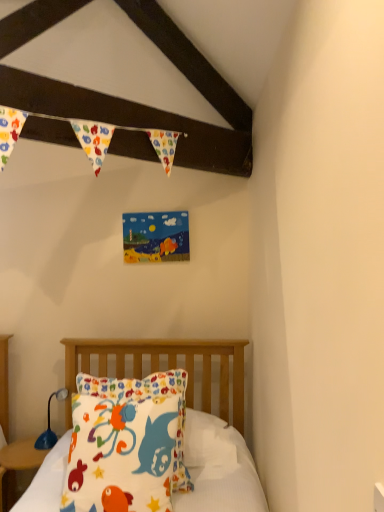
Identify the location of vacant area that is in front of blue plastic lamp at lower left. Image resolution: width=384 pixels, height=512 pixels. (29, 459).